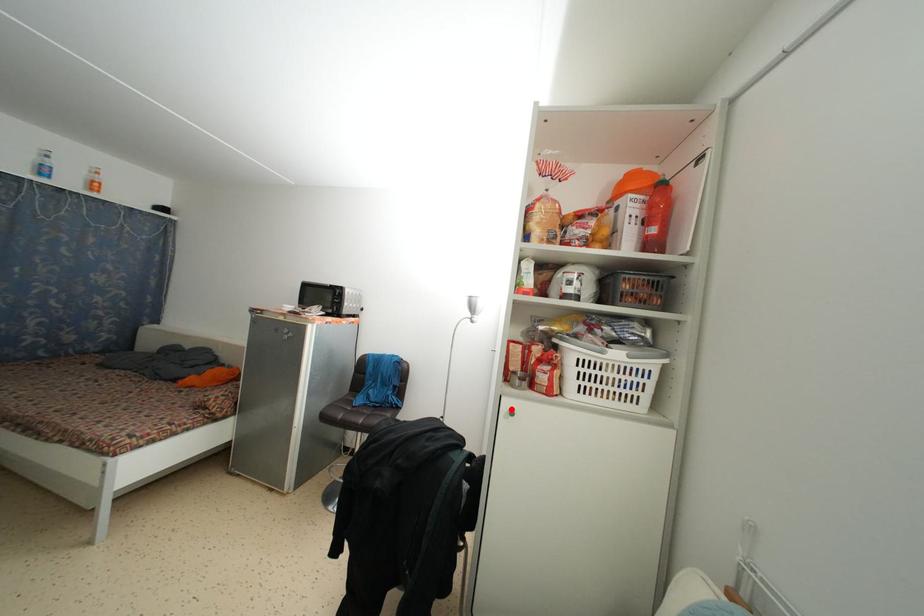
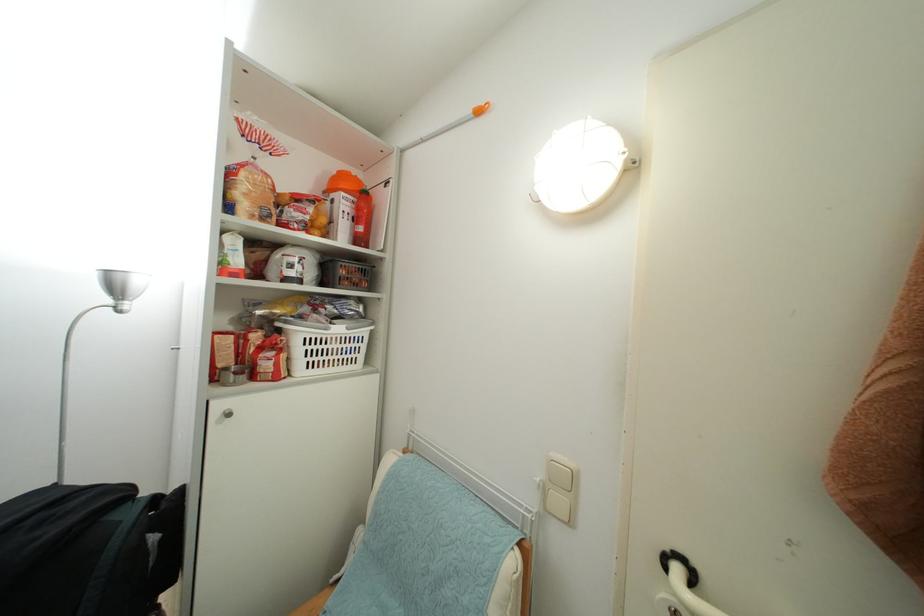
Where in the second image is the point corresponding to the highlighted location from the first image?

(224, 411)